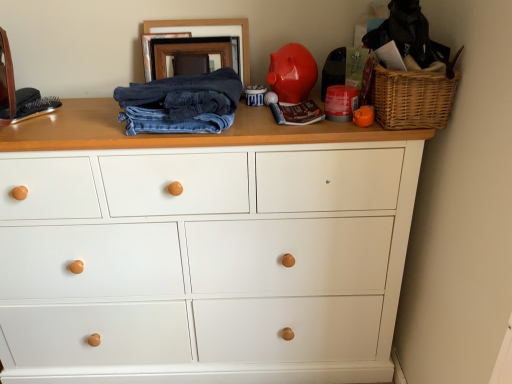
Locate an element on the screen. The image size is (512, 384). free space in front of glossy ceramic piggy bank at upper center is located at coordinates (270, 128).